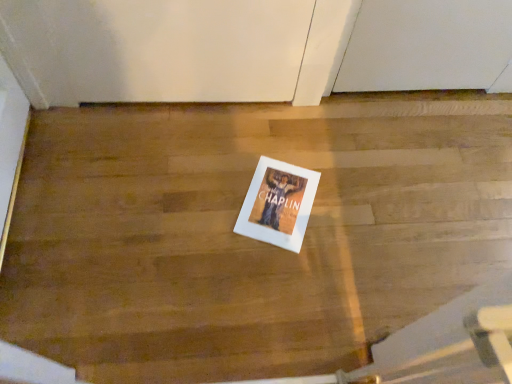
Locate an element on the screen. This screenshot has height=384, width=512. white paper at center is located at coordinates (278, 204).

What is the approximate width of white paper at center?

It is 12.49 inches.

What do you see at coordinates (278, 204) in the screenshot?
I see `white paper at center` at bounding box center [278, 204].

Locate an element on the screen. The height and width of the screenshot is (384, 512). white paper at center is located at coordinates (278, 204).